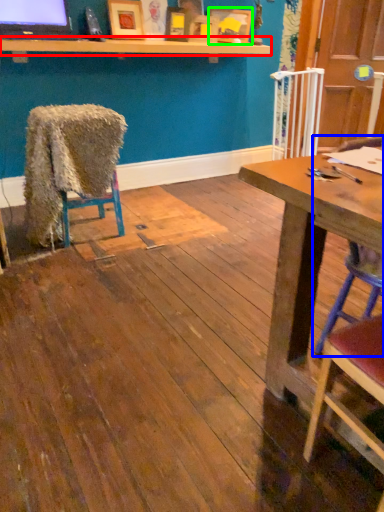
Question: Which is farther away from shelf (highlighted by a red box)? chair (highlighted by a blue box) or picture frame (highlighted by a green box)?

Choices:
 (A) chair
 (B) picture frame

Answer: (A)